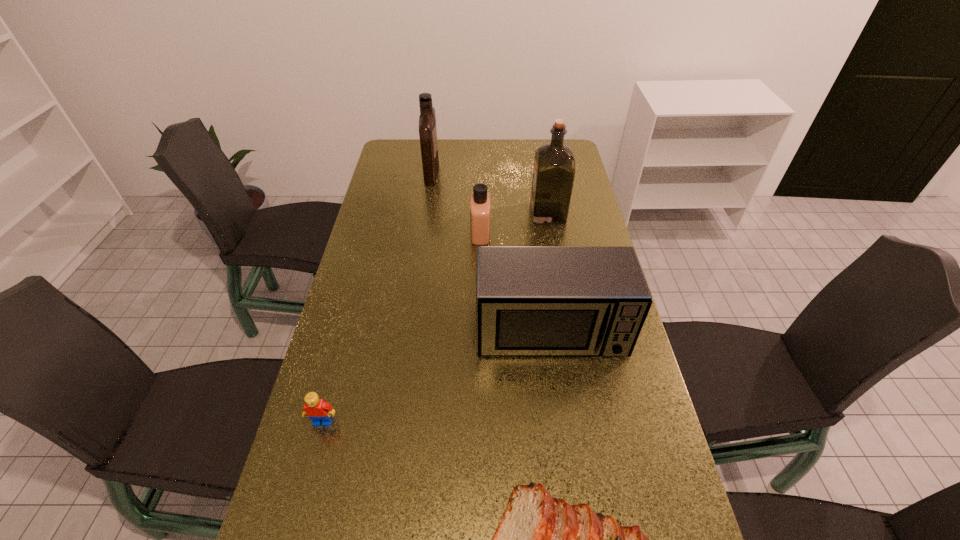
Where is `the nearer liquor`? This screenshot has height=540, width=960. the nearer liquor is located at coordinates (554, 163).

The image size is (960, 540). I want to click on the farthest object, so click(x=427, y=120).

Image resolution: width=960 pixels, height=540 pixels. Identify the location of the second object from left to right. [427, 120].

Find the location of a particular element. the third tallest object is located at coordinates (530, 300).

Identify the location of the fourth farthest object. (530, 300).

Identify the location of the third shortest object. The image size is (960, 540). (480, 199).

Where is `Lego`? Lego is located at coordinates (317, 410).

Find the location of a particular element. This screenshot has height=540, width=960. the fifth farthest object is located at coordinates (317, 410).

The image size is (960, 540). I want to click on vacant space located 0.090m on the label of the right liquor, so click(x=506, y=213).

Where is `free location located 0.400m on the label of the right liquor`? The image size is (960, 540). free location located 0.400m on the label of the right liquor is located at coordinates (421, 213).